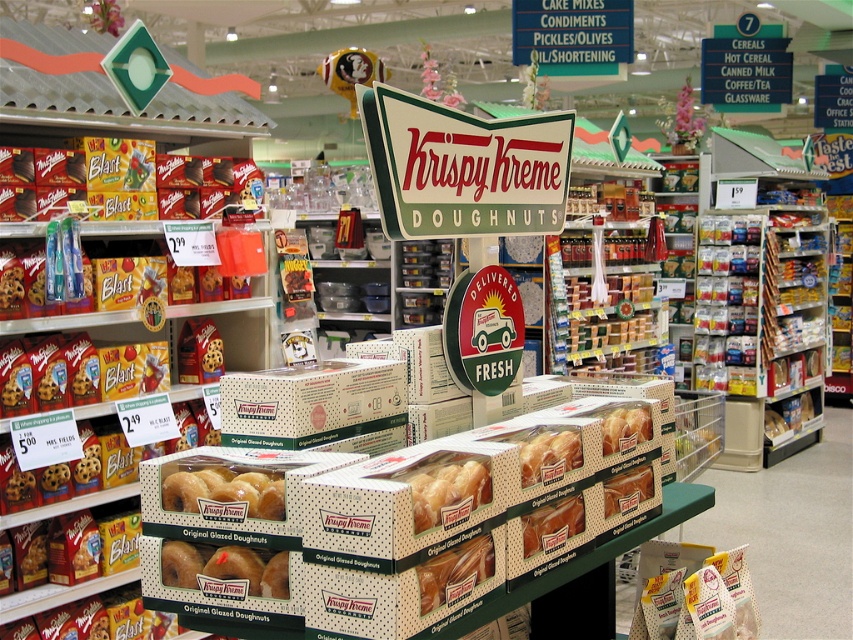
Question: Is white dotted cardboard box at center bigger than golden glazed doughnut at center?

Choices:
 (A) no
 (B) yes

Answer: (B)

Question: Which of these objects is positioned farthest from the white dotted cardboard box at center?

Choices:
 (A) matte glazed donut at center
 (B) golden glazed doughnut at center

Answer: (B)

Question: Is white dotted cardboard box at center smaller than golden glazed doughnut at center?

Choices:
 (A) yes
 (B) no

Answer: (B)

Question: Is white dotted cardboard box at center positioned at the back of golden glazed doughnut at center?

Choices:
 (A) yes
 (B) no

Answer: (A)

Question: Which of the following is the farthest from the observer?

Choices:
 (A) matte glazed donut at center
 (B) golden glazed doughnut at center
 (C) white dotted cardboard box at center

Answer: (C)

Question: Which of the following is the farthest from the observer?

Choices:
 (A) white dotted cardboard box at center
 (B) matte glazed donut at center
 (C) golden glazed doughnut at center

Answer: (A)